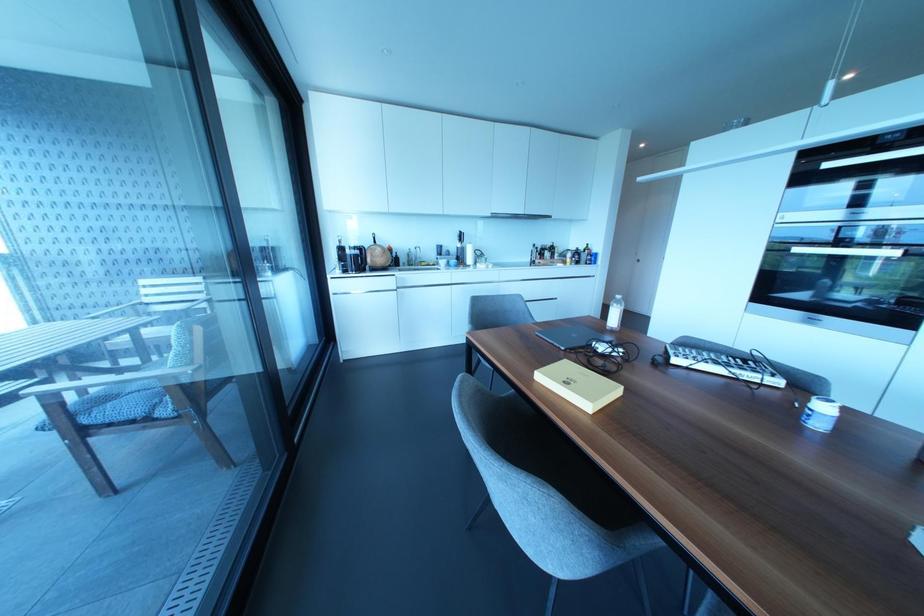
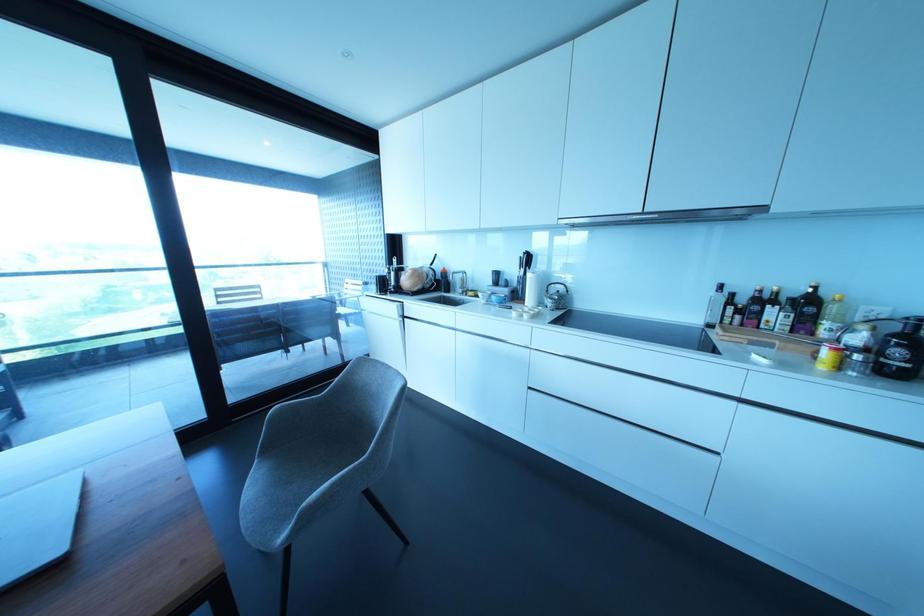
The point at [567,259] is marked in the first image. Where is the corresponding point in the second image?

(825, 353)